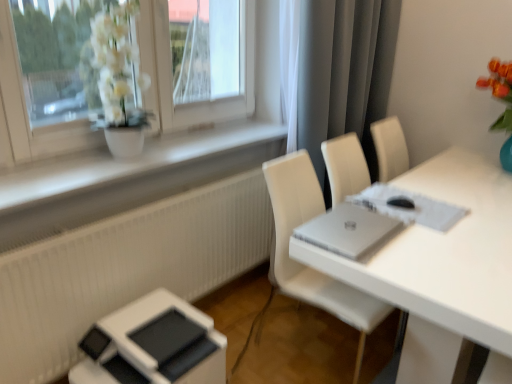
Where is `vacant area that lies in front of silver metallic laptop at center`? vacant area that lies in front of silver metallic laptop at center is located at coordinates (399, 269).